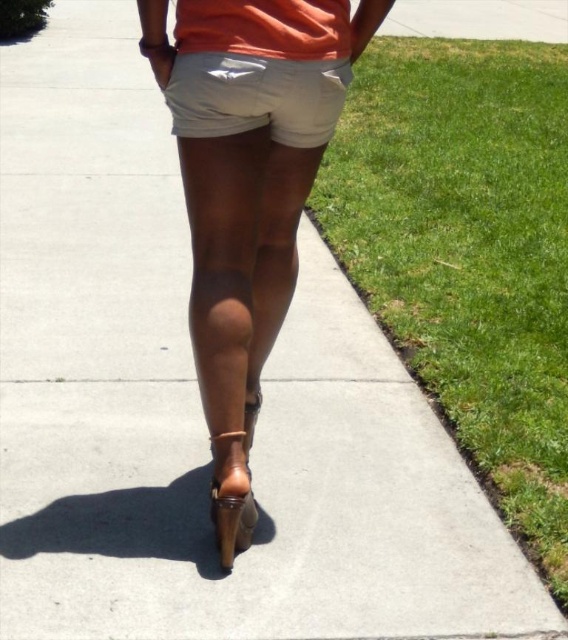
Describe the element at coordinates (240, 259) in the screenshot. I see `tan leather high heels at center` at that location.

Can you confirm if tan leather high heels at center is thinner than white cotton shorts at center?

No.

Where is `tan leather high heels at center`? The width and height of the screenshot is (568, 640). tan leather high heels at center is located at coordinates (240, 259).

Based on the photo, is tan leather high heels at center to the left of brown leather sandal at lower center from the viewer's perspective?

No, tan leather high heels at center is not to the left of brown leather sandal at lower center.

Looking at this image, does tan leather high heels at center appear over brown leather sandal at lower center?

Correct, tan leather high heels at center is located above brown leather sandal at lower center.

Is point (273, 273) positioned after point (249, 529)?

Yes.

You are a GUI agent. You are given a task and a screenshot of the screen. Output one action in this format:
    pyautogui.click(x=<x>, y=<y>)
    Task: Click on the tan leather high heels at center
    The height and width of the screenshot is (640, 568).
    Given the screenshot: What is the action you would take?
    pyautogui.click(x=240, y=259)

Does white cotton shorts at center appear on the right side of brown leather sandal at lower center?

Indeed, white cotton shorts at center is positioned on the right side of brown leather sandal at lower center.

Find the location of a particular element. The image size is (568, 640). white cotton shorts at center is located at coordinates (256, 97).

Where is `white cotton shorts at center`? white cotton shorts at center is located at coordinates (256, 97).

This screenshot has height=640, width=568. What are the coordinates of `white cotton shorts at center` in the screenshot? It's located at (256, 97).